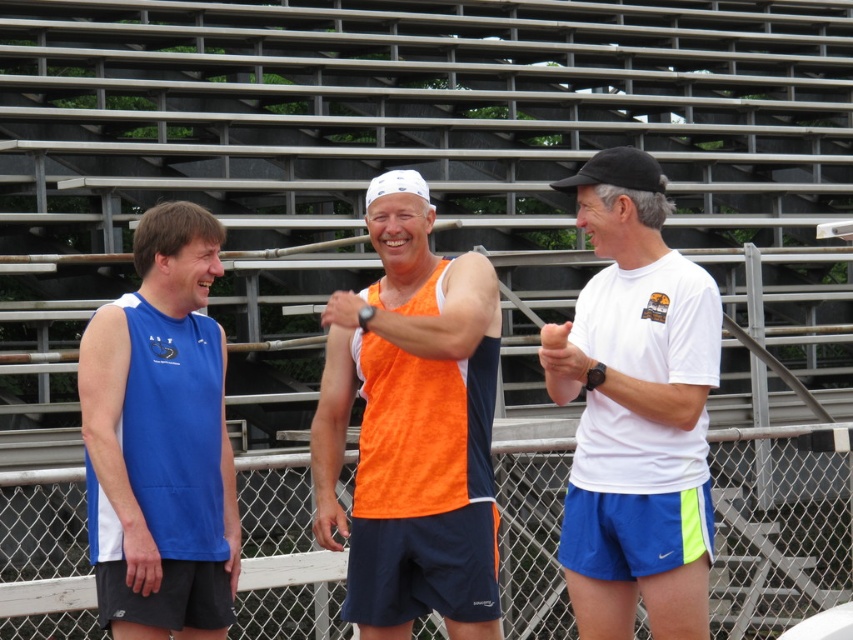
Question: Does orange fabric tank top at center have a lesser width compared to blue sleeveless shirt at left?

Choices:
 (A) yes
 (B) no

Answer: (B)

Question: Does orange fabric tank top at center have a greater width compared to white matte t-shirt at center?

Choices:
 (A) yes
 (B) no

Answer: (A)

Question: Among these objects, which one is farthest from the camera?

Choices:
 (A) orange fabric tank top at center
 (B) blue sleeveless shirt at left

Answer: (A)

Question: Which of the following is the closest to the observer?

Choices:
 (A) (614, 600)
 (B) (465, 600)
 (C) (161, 451)

Answer: (C)

Question: Does orange fabric tank top at center have a smaller size compared to blue sleeveless shirt at left?

Choices:
 (A) no
 (B) yes

Answer: (A)

Question: Which point is farther from the camera taking this photo?

Choices:
 (A) (479, 614)
 (B) (138, 285)

Answer: (B)